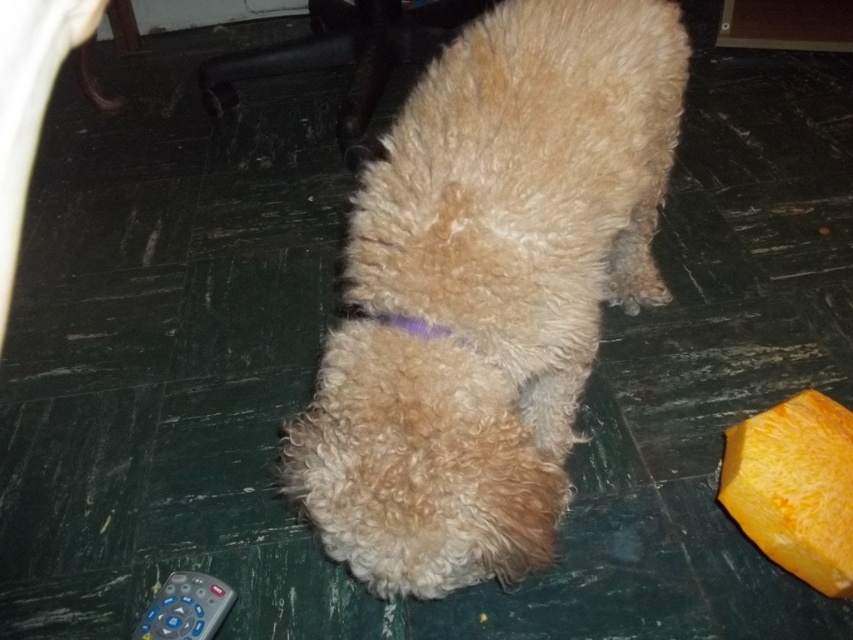
You are a dog owner who wants to fetch the gray plastic remote at lower left without stepping on the orange smooth pumpkin at lower right. Based on the scene, can you reach the remote without disturbing the pumpkin?

The orange smooth pumpkin at lower right is above the gray plastic remote at lower left, so you can reach the gray plastic remote at lower left without stepping on the pumpkin since it is located below the pumpkin.

You are a photographer trying to capture the dog in the image. The dog is located at point [486,291]. If you want to position the dog exactly at the center of your camera frame, which is at point 0.5, 0.5, should you move the camera slightly to the left or right? Explain your reasoning based on the dog location coordinates.

The dog is located at point [486,291]. The camera frame center is at 0.5, 0.5. Since the dog is to the left of the center point in the x coordinate and above in the y coordinate, you should move the camera slightly to the right and down to center the dog.